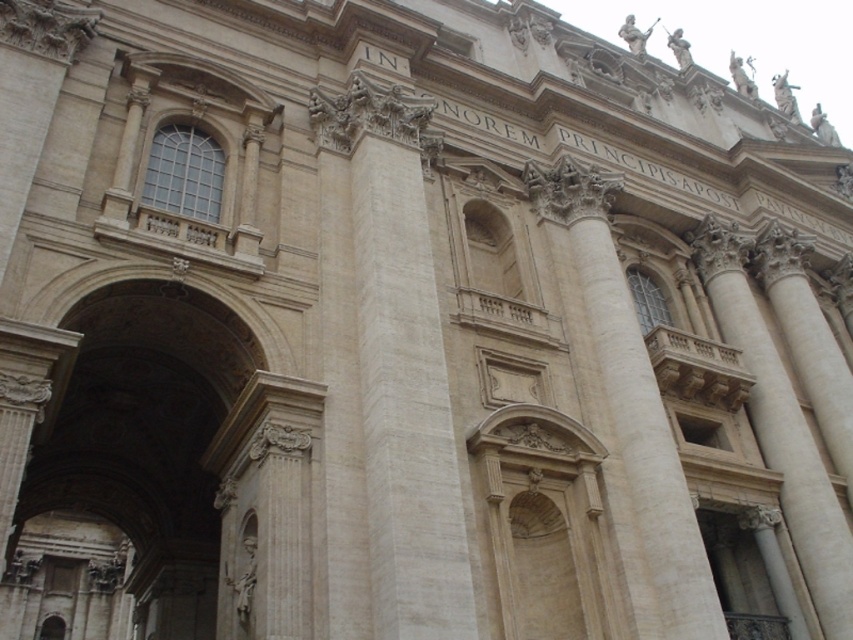
Who is positioned more to the left, white marble column at center or beige stone column at center?

From the viewer's perspective, white marble column at center appears more on the left side.

Which is in front, point (401, 291) or point (590, 236)?

Point (401, 291) is more forward.

Find the location of `white marble column at center`. white marble column at center is located at coordinates (399, 368).

Does white marble column at center appear under smooth stone column at right?

No.

Can you confirm if white marble column at center is shorter than smooth stone column at right?

Incorrect, white marble column at center's height does not fall short of smooth stone column at right's.

Measure the distance between white marble column at center and camera.

white marble column at center is 45.42 meters from camera.

At what (x,y) coordinates should I click in order to perform the action: click on white marble column at center. Please return your answer as a coordinate pair (x, y). Image resolution: width=853 pixels, height=640 pixels. Looking at the image, I should click on (399, 368).

How much distance is there between beige stone column at center and smooth stone column at right?

beige stone column at center and smooth stone column at right are 50.10 feet apart from each other.

Which of these two, beige stone column at center or smooth stone column at right, stands shorter?

Standing shorter between the two is smooth stone column at right.

Between point (651, 531) and point (738, 250), which one is positioned in front?

Point (651, 531)

Locate an element on the screen. beige stone column at center is located at coordinates (631, 401).